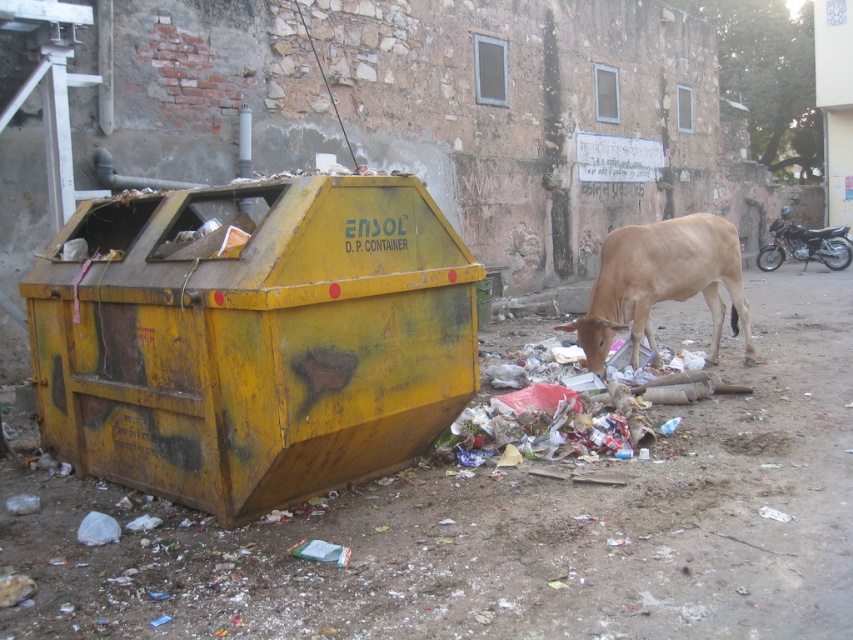
Question: Can you confirm if yellow matte container at left is wider than light brown cow at center?

Choices:
 (A) yes
 (B) no

Answer: (A)

Question: Is yellow matte container at left further to camera compared to light brown cow at center?

Choices:
 (A) no
 (B) yes

Answer: (A)

Question: Which object is farther from the camera taking this photo?

Choices:
 (A) light brown cow at center
 (B) yellow matte container at left

Answer: (A)

Question: Is the position of yellow matte container at left less distant than that of light brown cow at center?

Choices:
 (A) yes
 (B) no

Answer: (A)

Question: Which point is closer to the camera?

Choices:
 (A) (291, 291)
 (B) (634, 259)

Answer: (A)

Question: Which point appears closest to the camera in this image?

Choices:
 (A) (614, 317)
 (B) (202, 202)

Answer: (B)